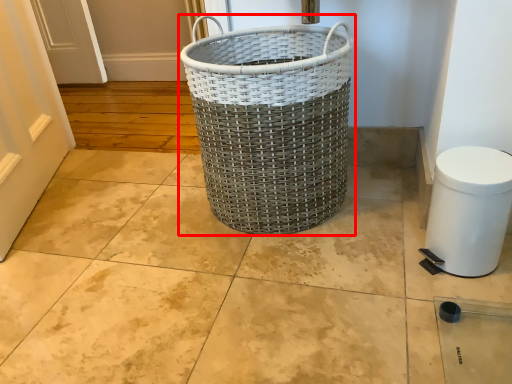
Question: From the image's perspective, what is the correct spatial positioning of waste container (annotated by the red box) in reference to gray?

Choices:
 (A) below
 (B) above

Answer: (B)